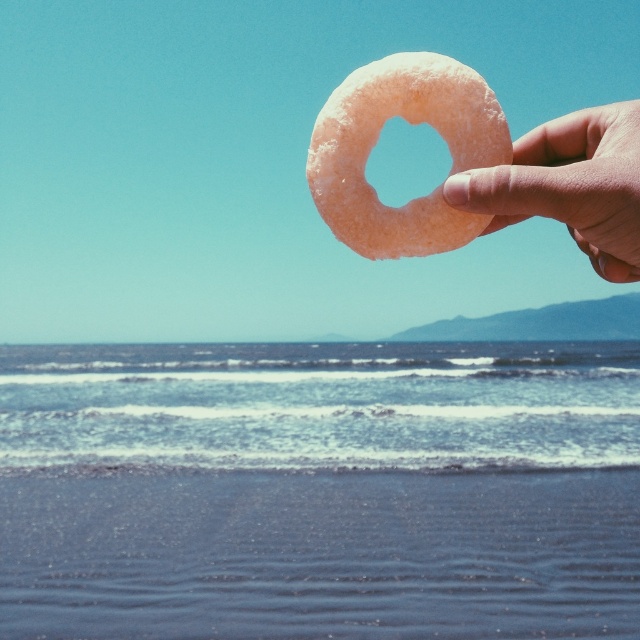
Looking at the image, which object is wider between the sandy beach at lower left and the slightly pinkish matte donut at upper right?

The sandy beach at lower left is wider than the slightly pinkish matte donut at upper right according to the description.